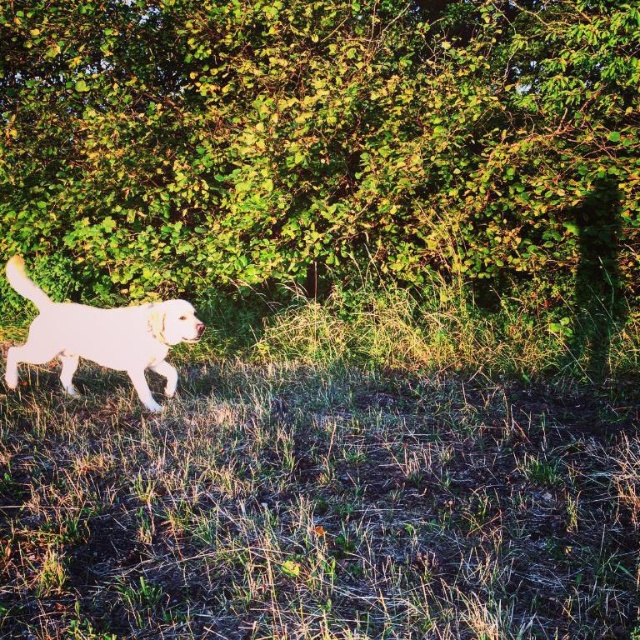
You are a photographer standing at the edge of the grassy area. You want to take a photo of the white fur dog at center and the green leafy bush at center. If your camera can focus on objects within 2 meters, will both subjects be in focus?

The green leafy bush at center is 2.38 meters from the white fur dog at center, so the distance between them is greater than 2 meters. Therefore, if the camera focuses on one subject, the other may be out of focus. However, if both are within the camera sensor range, they might be in focus depending on the depth of field. But according to the given information, the distance between them is over 2 meters, so it might not be possible to have both in focus simultaneously.

You are a photographer trying to capture a clear shot of the white fur dog at center. However, there is a green leafy bush at center blocking your view. Can you adjust your position to see the dog without the bush obstructing the view?

The green leafy bush at center is further to the viewer than the white fur dog at center, so moving your camera position slightly forward or adjusting the angle might allow you to see the dog behind the bush.

You are a photographer trying to capture a photo of the white fur dog at center. You want to ensure the green leafy bush at center is fully visible in the background. Given their sizes, do you think the bush will be entirely visible in the frame if you focus on the dog?

The green leafy bush at center is narrower than the white fur dog at center, so if the dog is centered in the frame, the bush should be fully visible in the background since it is smaller in width.